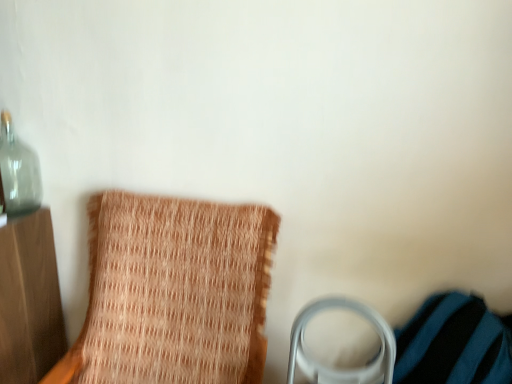
Question: Considering their positions, is transparent glass bottle at upper left located in front of or behind woven fabric chair at left?

Choices:
 (A) front
 (B) behind

Answer: (B)

Question: In terms of size, does transparent glass bottle at upper left appear bigger or smaller than woven fabric chair at left?

Choices:
 (A) big
 (B) small

Answer: (B)

Question: In terms of height, does transparent glass bottle at upper left look taller or shorter compared to woven fabric chair at left?

Choices:
 (A) tall
 (B) short

Answer: (B)

Question: Is woven fabric chair at left inside or outside of transparent glass bottle at upper left?

Choices:
 (A) outside
 (B) inside

Answer: (A)

Question: Is woven fabric chair at left taller or shorter than transparent glass bottle at upper left?

Choices:
 (A) tall
 (B) short

Answer: (A)

Question: Looking at the image, does woven fabric chair at left seem bigger or smaller compared to transparent glass bottle at upper left?

Choices:
 (A) big
 (B) small

Answer: (A)

Question: From a real-world perspective, relative to transparent glass bottle at upper left, is woven fabric chair at left vertically above or below?

Choices:
 (A) below
 (B) above

Answer: (A)